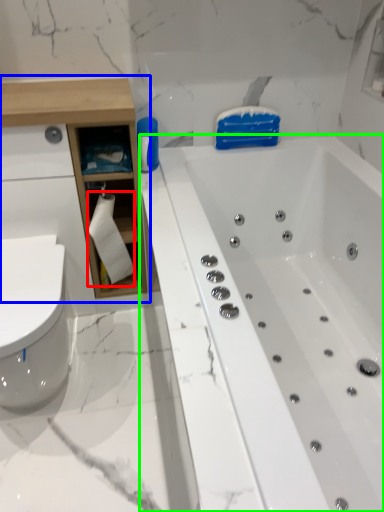
Question: Which object is positioned farthest from toilet paper (highlighted by a red box)? Select from cabinetry (highlighted by a blue box) and bathtub (highlighted by a green box).

Choices:
 (A) cabinetry
 (B) bathtub

Answer: (B)